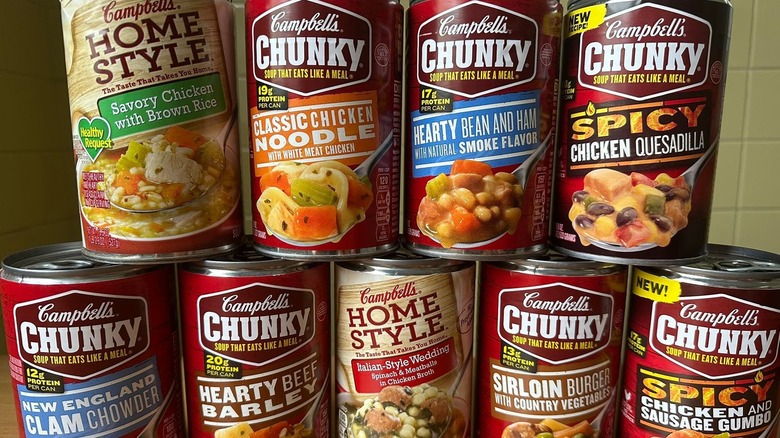
The image size is (780, 438). What are the coordinates of `tile` in the screenshot? It's located at click(739, 34), click(764, 33), click(734, 92), click(749, 101), click(725, 157), click(752, 167), click(714, 232), click(753, 233).